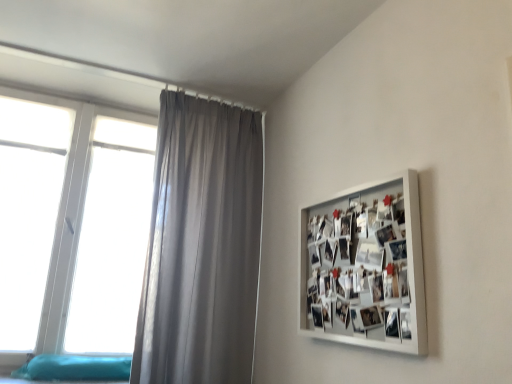
Question: Is satin gray curtain at upper left thinner than white plastic window at left?

Choices:
 (A) no
 (B) yes

Answer: (A)

Question: Considering the relative sizes of satin gray curtain at upper left and white plastic window at left in the image provided, is satin gray curtain at upper left smaller than white plastic window at left?

Choices:
 (A) no
 (B) yes

Answer: (B)

Question: Is satin gray curtain at upper left next to white plastic window at left and touching it?

Choices:
 (A) yes
 (B) no

Answer: (B)

Question: Is white plastic window at left surrounded by satin gray curtain at upper left?

Choices:
 (A) no
 (B) yes

Answer: (A)

Question: From a real-world perspective, is satin gray curtain at upper left positioned under white plastic window at left based on gravity?

Choices:
 (A) no
 (B) yes

Answer: (B)

Question: From the image's perspective, is satin gray curtain at upper left over white plastic window at left?

Choices:
 (A) no
 (B) yes

Answer: (A)

Question: Can you confirm if white matte picture frame at upper right is shorter than satin gray curtain at upper left?

Choices:
 (A) yes
 (B) no

Answer: (A)

Question: Is white matte picture frame at upper right completely or partially outside of satin gray curtain at upper left?

Choices:
 (A) yes
 (B) no

Answer: (A)

Question: Is white matte picture frame at upper right oriented away from satin gray curtain at upper left?

Choices:
 (A) no
 (B) yes

Answer: (A)

Question: Can you confirm if white matte picture frame at upper right is taller than satin gray curtain at upper left?

Choices:
 (A) yes
 (B) no

Answer: (B)

Question: Is white matte picture frame at upper right with satin gray curtain at upper left?

Choices:
 (A) no
 (B) yes

Answer: (A)

Question: From a real-world perspective, does white matte picture frame at upper right sit lower than satin gray curtain at upper left?

Choices:
 (A) yes
 (B) no

Answer: (A)

Question: Does white matte picture frame at upper right appear on the left side of teal fabric bed at lower left?

Choices:
 (A) no
 (B) yes

Answer: (A)